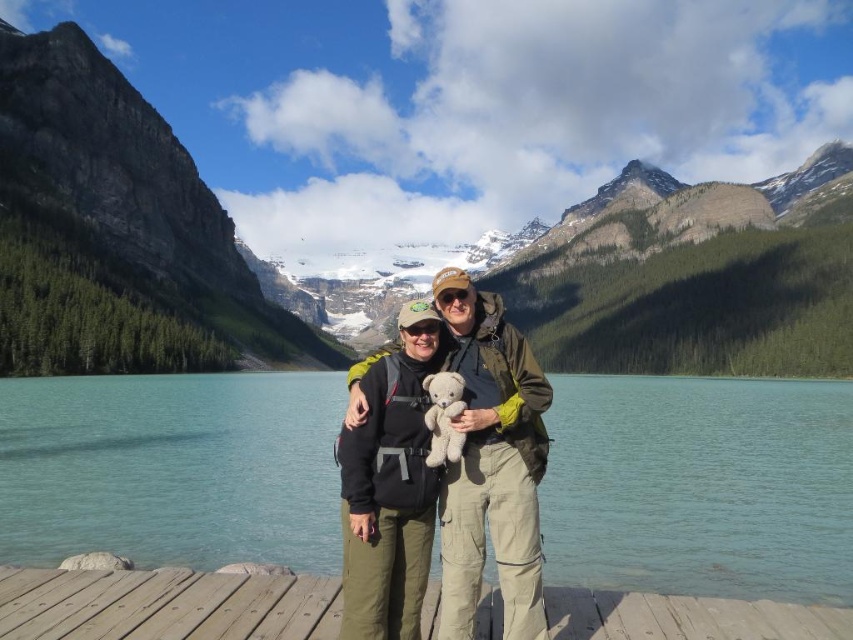
Question: Estimate the real-world distances between objects in this image. Which object is closer to the green rock mountain at center?

Choices:
 (A) white plush bear at center
 (B) wooden dock at center
 (C) rocky gray mountain at left
 (D) beige fabric teddy bear at center

Answer: (C)

Question: Among these objects, which one is nearest to the camera?

Choices:
 (A) green rock mountain at center
 (B) wooden dock at center
 (C) white plush bear at center

Answer: (B)

Question: Can you confirm if beige fabric teddy bear at center is positioned below white plush bear at center?

Choices:
 (A) yes
 (B) no

Answer: (A)

Question: Which object is farther from the camera taking this photo?

Choices:
 (A) white plush bear at center
 (B) teal glassy water at center
 (C) beige fabric teddy bear at center

Answer: (B)

Question: Does wooden dock at center come in front of white plush bear at center?

Choices:
 (A) no
 (B) yes

Answer: (B)

Question: Does teal glassy water at center appear on the right side of rocky gray mountain at left?

Choices:
 (A) no
 (B) yes

Answer: (B)